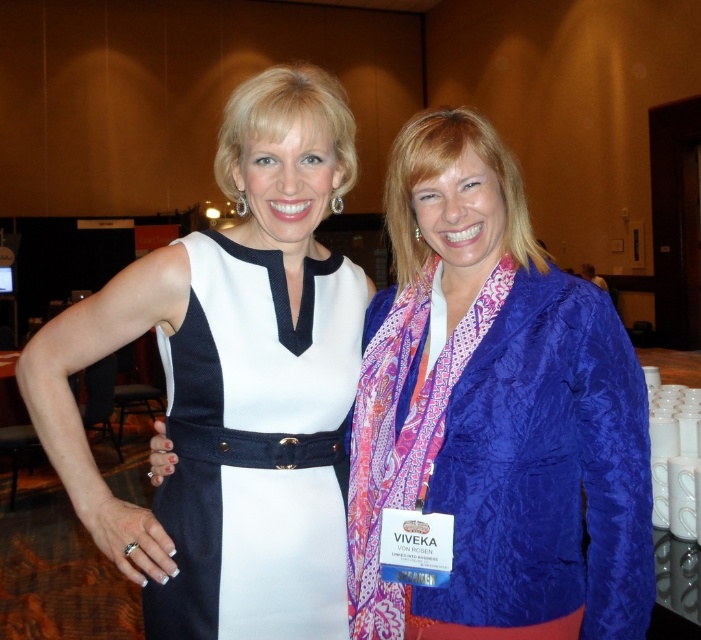
Question: Does blue silk blazer at center come in front of white fabric dress at center?

Choices:
 (A) no
 (B) yes

Answer: (B)

Question: Which point appears farthest from the camera in this image?

Choices:
 (A) [x=437, y=388]
 (B) [x=318, y=621]

Answer: (B)

Question: Estimate the real-world distances between objects in this image. Which object is farther from the blue silk blazer at center?

Choices:
 (A) white fabric dress at center
 (B) white textured fabric dress at left

Answer: (A)

Question: Does blue silk blazer at center lie in front of white fabric dress at center?

Choices:
 (A) yes
 (B) no

Answer: (A)

Question: Is blue silk blazer at center closer to camera compared to white textured fabric dress at left?

Choices:
 (A) no
 (B) yes

Answer: (B)

Question: Which is farther from the white textured fabric dress at left?

Choices:
 (A) blue silk blazer at center
 (B) white fabric dress at center

Answer: (A)